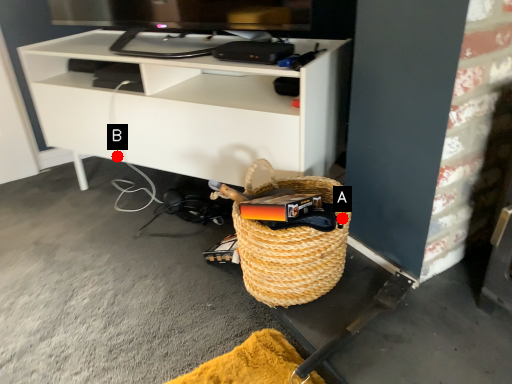
Question: Two points are circled on the image, labeled by A and B beside each circle. Which point is closer to the camera?

Choices:
 (A) A is closer
 (B) B is closer

Answer: (A)